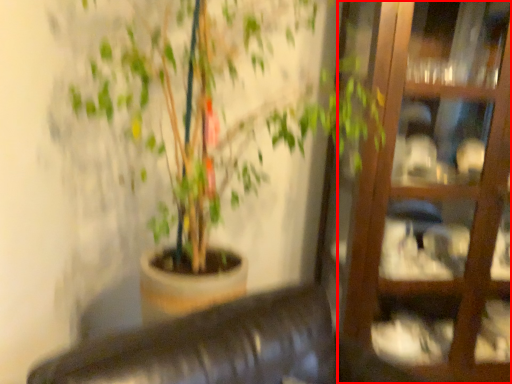
Question: From the image's perspective, what is the correct spatial relationship of glass door (annotated by the red box) in relation to houseplant?

Choices:
 (A) below
 (B) above

Answer: (A)